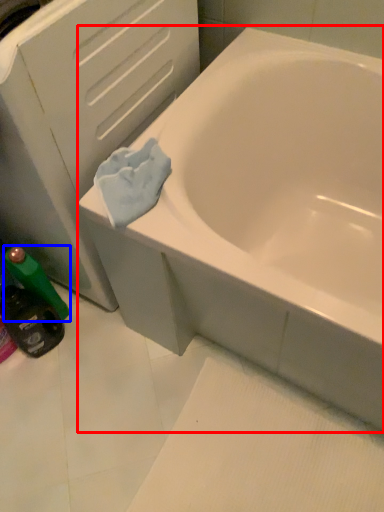
Question: Which object appears closest to the camera in this image, bathtub (highlighted by a red box) or mouthwash (highlighted by a blue box)?

Choices:
 (A) bathtub
 (B) mouthwash

Answer: (A)